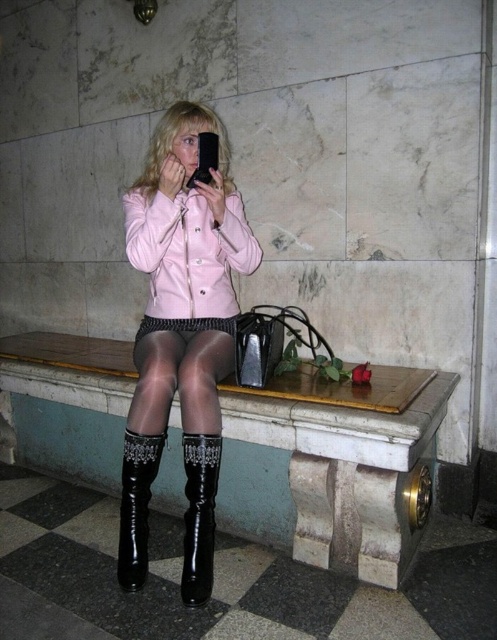
You are trying to place a rectangular box that is 1.2 meters wide on the wooden bench at center. Can the box fit on the bench if the black leather boot at lower left is currently occupying part of the space?

The wooden bench at center might be wider than black leather boot at lower left, so there is a possibility that the box could fit if the remaining space on the bench after accounting for the boot is at least 1.2 meters wide. However, without exact measurements, it is uncertain.

You are standing 10 feet away from the bench. If you walk straight towards the bench for 3 feet, will you be closer to the point at coordinates point (396, 522) than the person sitting on the bench?

The distance of point (396, 522) from viewer is 6.08 feet. After moving 3 feet closer, your distance to the bench would be 10 feet minus 3 feet equals 7 feet. Since 6.08 feet is less than 7 feet, the point at coordinates point (396, 522) is closer to you than the person sitting on the bench.